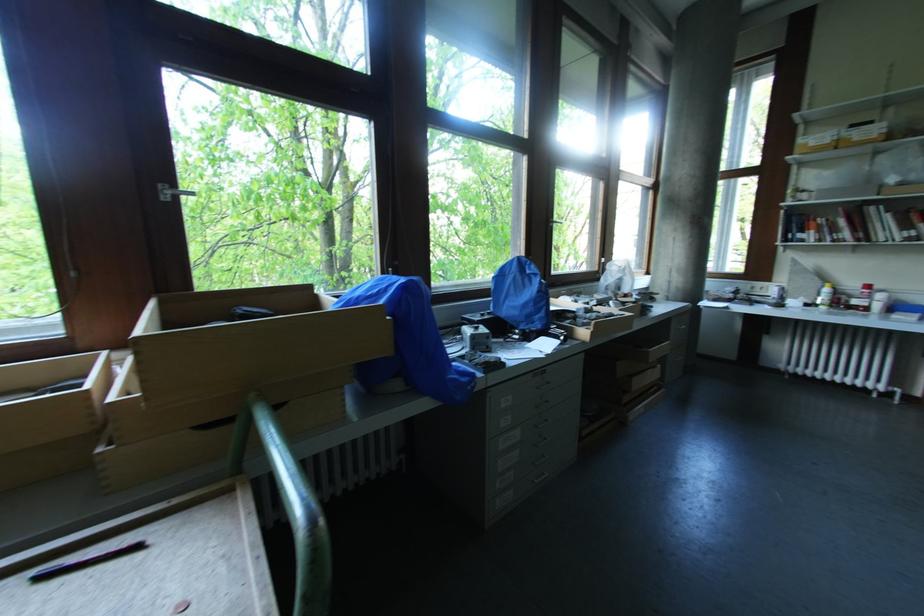
Where would you turn the window handle? Please return your answer as a coordinate pair (x, y).

(172, 192)